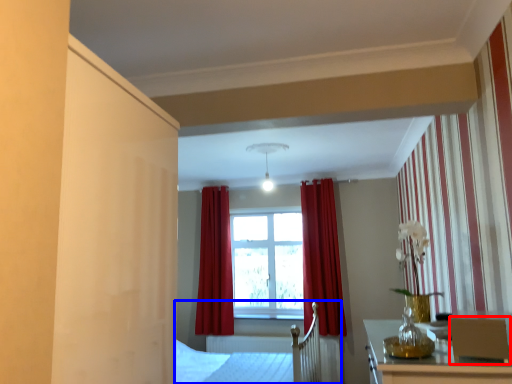
Question: Which of the following is the closest to the observer, armchair (highlighted by a red box) or bed frame (highlighted by a blue box)?

Choices:
 (A) armchair
 (B) bed frame

Answer: (A)